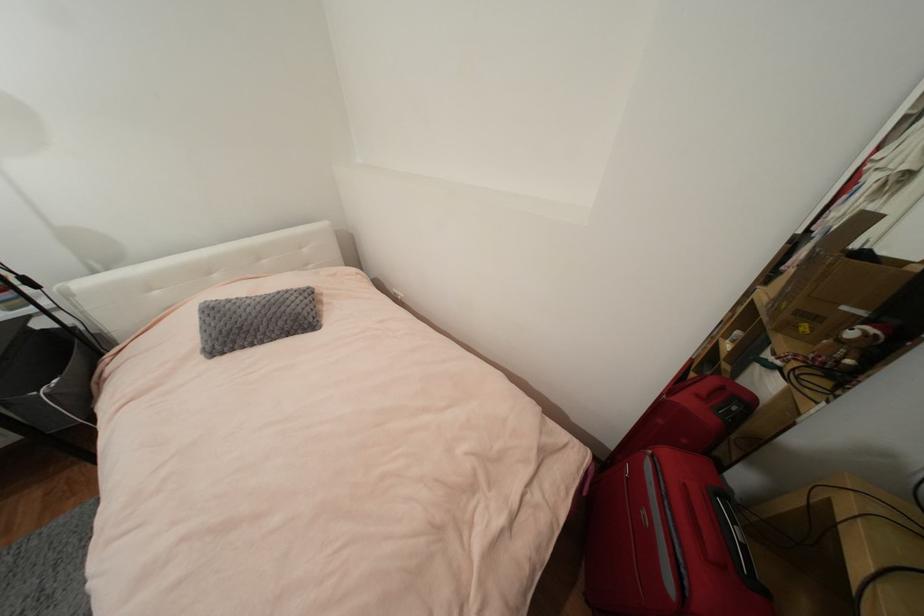
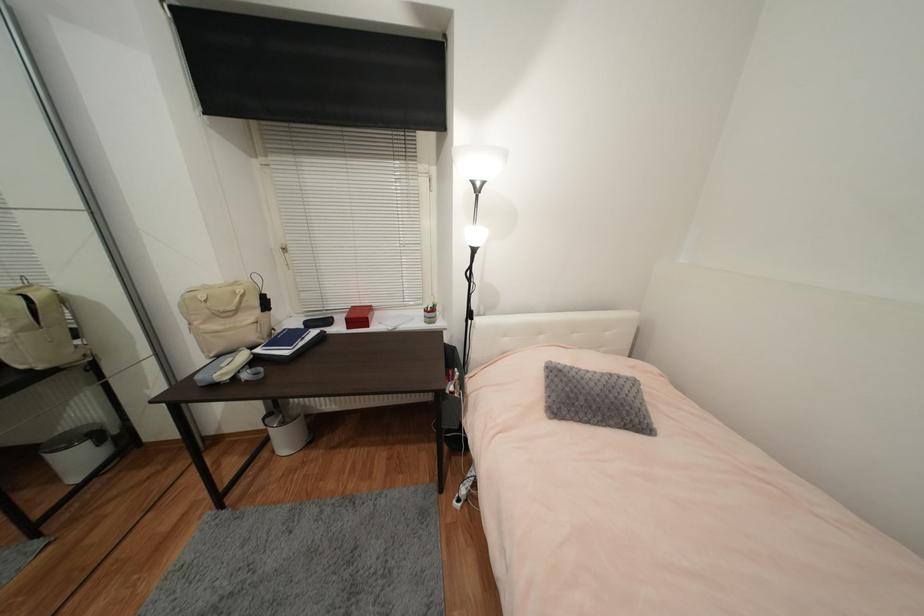
Find the pixel in the second image that matches point (258, 314) in the first image.

(602, 391)